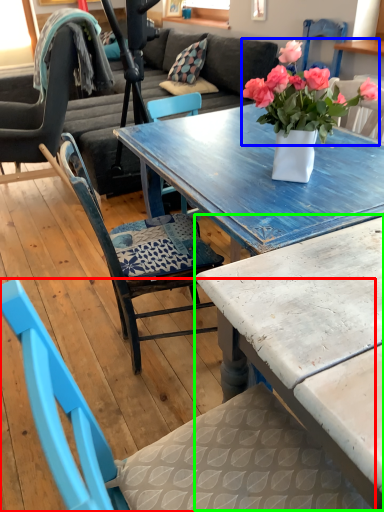
Question: Considering the real-world distances, which object is farthest from chair (highlighted by a red box)? flower (highlighted by a blue box) or coffee table (highlighted by a green box)?

Choices:
 (A) flower
 (B) coffee table

Answer: (A)